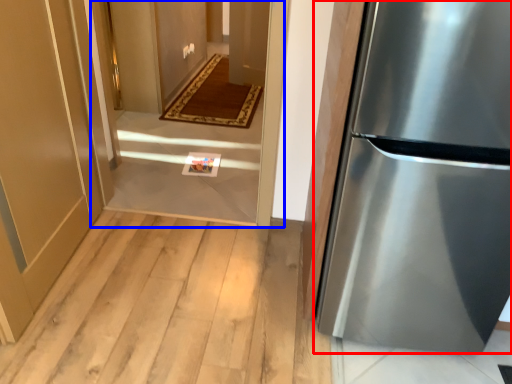
Question: Which object is further to the camera taking this photo, refrigerator (highlighted by a red box) or corridor (highlighted by a blue box)?

Choices:
 (A) refrigerator
 (B) corridor

Answer: (B)